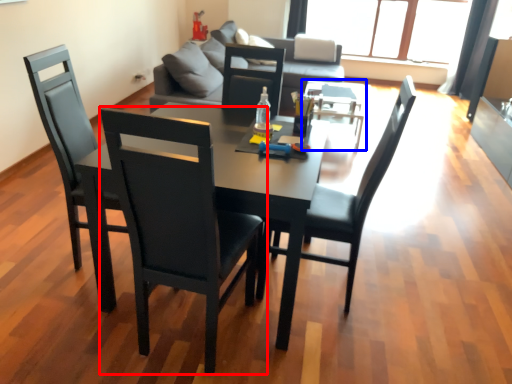
Question: Which object is closer to the camera taking this photo, chair (highlighted by a red box) or coffee table (highlighted by a blue box)?

Choices:
 (A) chair
 (B) coffee table

Answer: (A)